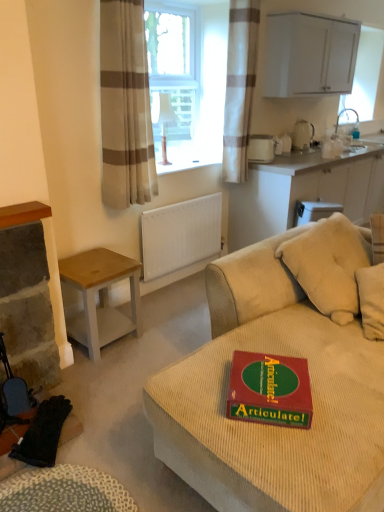
Question: Is matte white lampshade at center in front of or behind silver metallic faucet at upper right in the image?

Choices:
 (A) front
 (B) behind

Answer: (A)

Question: Considering the relative positions of matte white lampshade at center and silver metallic faucet at upper right in the image provided, is matte white lampshade at center to the left or to the right of silver metallic faucet at upper right?

Choices:
 (A) left
 (B) right

Answer: (A)

Question: Which of these objects is positioned closest to the beige striped curtain at upper center, marked as the 1th curtain in a front-to-back arrangement?

Choices:
 (A) white glossy kettle at upper right, marked as the first appliance in a right-to-left arrangement
 (B) white matte radiator at center
 (C) silver metallic faucet at upper right
 (D) matte white lampshade at center
 (E) white glossy cabinet at upper right, which is the second cabinetry from bottom to top

Answer: (D)

Question: Considering the real-world distances, which object is closest to the white glossy kettle at upper right, marked as the first appliance in a right-to-left arrangement?

Choices:
 (A) light brown wood desk at left
 (B) silver metallic faucet at upper right
 (C) green cardboard game at center
 (D) white glossy cabinet at upper right, which is the second cabinetry from bottom to top
 (E) white matte cabinet at upper right, which ranks as the 2th cabinetry in top-to-bottom order

Answer: (B)